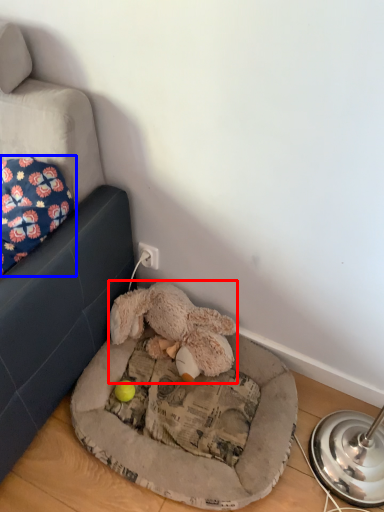
Question: Which of the following is the closest to the observer, toy (highlighted by a red box) or pillow (highlighted by a blue box)?

Choices:
 (A) toy
 (B) pillow

Answer: (B)